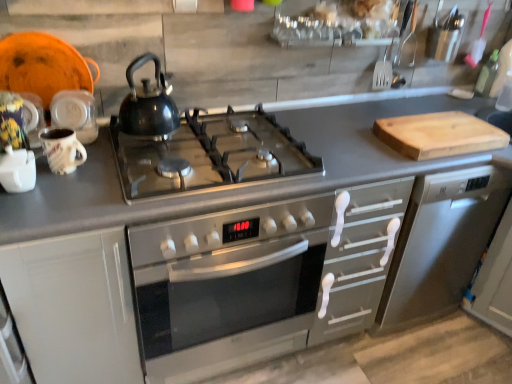
You are a GUI agent. You are given a task and a screenshot of the screen. Output one action in this format:
    pyautogui.click(x=<x>, y=<y>)
    Task: Click on the vacant space to the right of glossy black kettle at center
    The image size is (512, 384).
    Given the screenshot: What is the action you would take?
    pyautogui.click(x=215, y=141)